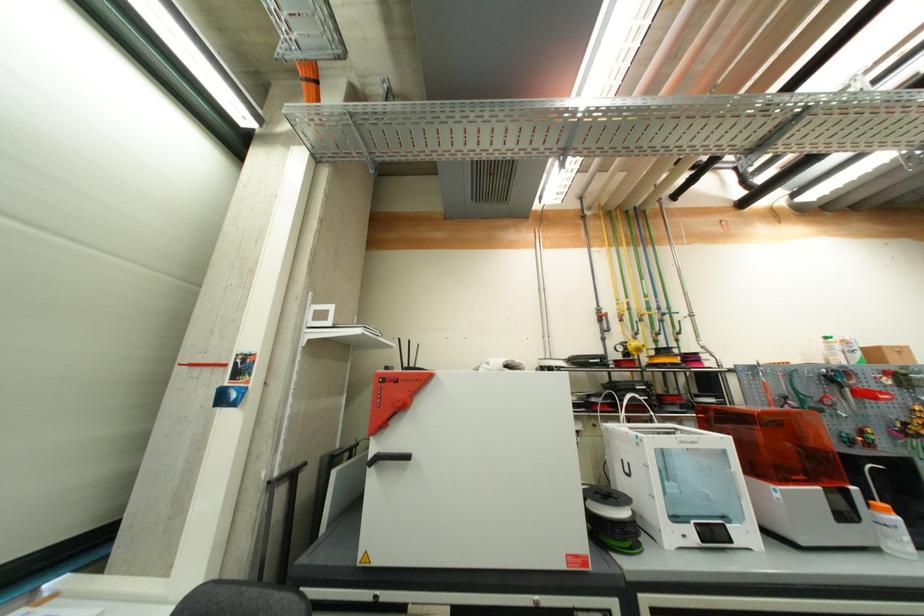
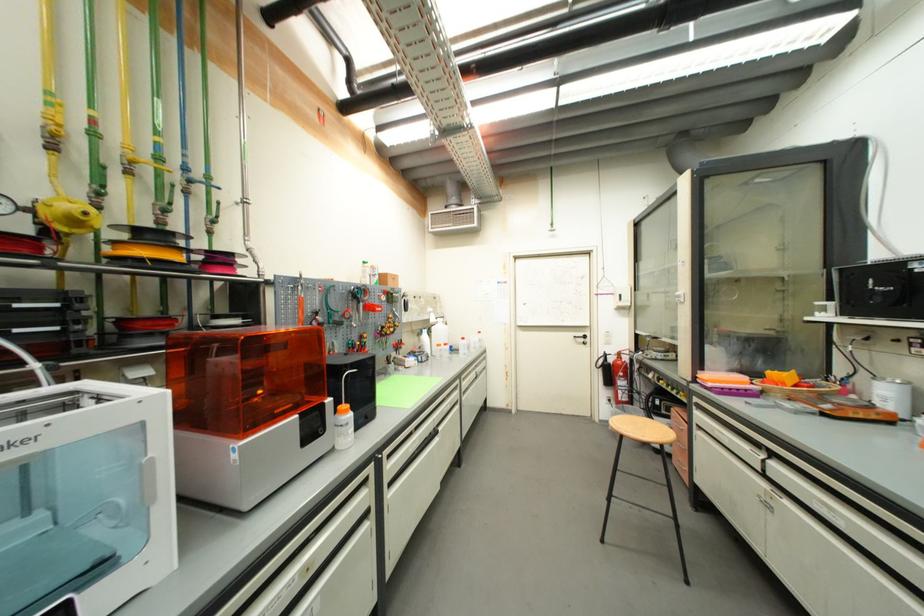
Find the pixel in the second image that matches point (886, 506) in the first image.

(349, 408)